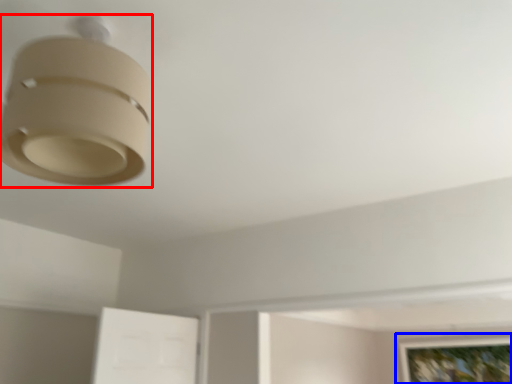
Question: Which object appears farthest to the camera in this image, lamp (highlighted by a red box) or picture frame (highlighted by a blue box)?

Choices:
 (A) lamp
 (B) picture frame

Answer: (B)